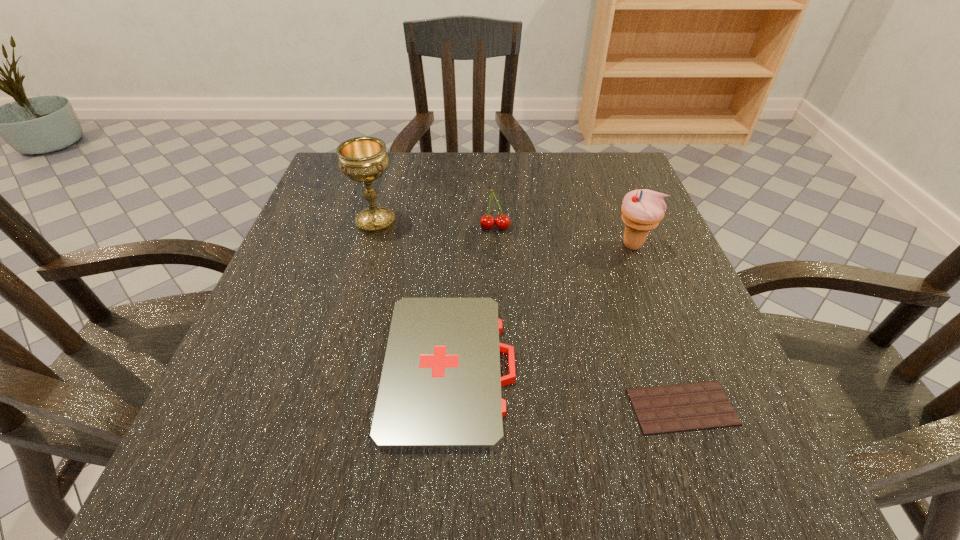
You are a GUI agent. You are given a task and a screenshot of the screen. Output one action in this format:
    pyautogui.click(x=<x>, y=<y>)
    Task: Click on the vacant space at the left edge
    The height and width of the screenshot is (540, 960).
    Given the screenshot: What is the action you would take?
    pyautogui.click(x=305, y=400)

You are a GUI agent. You are given a task and a screenshot of the screen. Output one action in this format:
    pyautogui.click(x=<x>, y=<y>)
    Task: Click on the vacant area at the right edge
    This screenshot has height=540, width=960.
    Given the screenshot: What is the action you would take?
    pyautogui.click(x=658, y=267)

At what (x,y) coordinates should I click in order to perform the action: click on free space at the near left corner of the desktop. Please return your answer as a coordinate pair (x, y). Looking at the image, I should click on (200, 448).

Locate an element on the screen. Image resolution: width=960 pixels, height=540 pixels. free spot between the leftmost object and the second shortest object is located at coordinates (413, 294).

This screenshot has width=960, height=540. I want to click on free area in between the shortest object and the icecream, so click(658, 326).

The height and width of the screenshot is (540, 960). I want to click on free point between the fourth shortest object and the shortest object, so click(x=658, y=326).

I want to click on vacant area that lies between the first-aid kit and the chocolate bar, so click(x=566, y=387).

Locate an element on the screen. The image size is (960, 540). vacant area that lies between the first-aid kit and the second tallest object is located at coordinates (541, 306).

Identify the location of vacant area that lies between the icecream and the chocolate bar. The width and height of the screenshot is (960, 540). (658, 326).

What are the coordinates of `free point between the icecream and the third shortest object` in the screenshot? It's located at (564, 237).